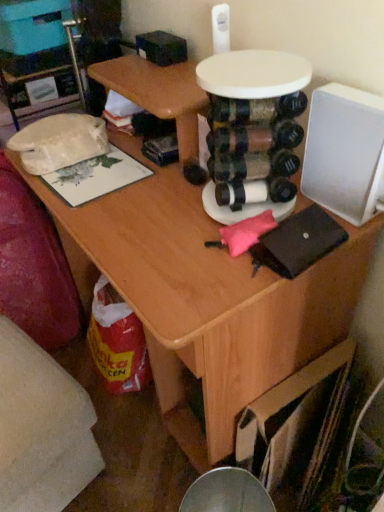
Question: From a real-world perspective, does white plastic round table at center sit lower than white fabric swivel chair at lower left?

Choices:
 (A) no
 (B) yes

Answer: (A)

Question: From a real-world perspective, is white plastic round table at center on white fabric swivel chair at lower left?

Choices:
 (A) yes
 (B) no

Answer: (A)

Question: Considering the relative sizes of white plastic round table at center and white fabric swivel chair at lower left in the image provided, is white plastic round table at center smaller than white fabric swivel chair at lower left?

Choices:
 (A) yes
 (B) no

Answer: (A)

Question: Does white plastic round table at center lie behind white fabric swivel chair at lower left?

Choices:
 (A) yes
 (B) no

Answer: (B)

Question: Is white plastic round table at center wider than white fabric swivel chair at lower left?

Choices:
 (A) yes
 (B) no

Answer: (B)

Question: Is white plastic round table at center positioned far away from white fabric swivel chair at lower left?

Choices:
 (A) yes
 (B) no

Answer: (B)

Question: Is white fabric swivel chair at lower left looking in the opposite direction of white plastic round table at center?

Choices:
 (A) no
 (B) yes

Answer: (A)

Question: From the image's perspective, does white fabric swivel chair at lower left appear higher than white plastic round table at center?

Choices:
 (A) no
 (B) yes

Answer: (A)

Question: Is the position of white fabric swivel chair at lower left more distant than that of white plastic round table at center?

Choices:
 (A) no
 (B) yes

Answer: (B)

Question: Considering the relative sizes of white fabric swivel chair at lower left and white plastic round table at center in the image provided, is white fabric swivel chair at lower left smaller than white plastic round table at center?

Choices:
 (A) yes
 (B) no

Answer: (B)

Question: Considering the relative sizes of white fabric swivel chair at lower left and white plastic round table at center in the image provided, is white fabric swivel chair at lower left shorter than white plastic round table at center?

Choices:
 (A) no
 (B) yes

Answer: (A)

Question: Does white fabric swivel chair at lower left have a lesser width compared to white plastic round table at center?

Choices:
 (A) yes
 (B) no

Answer: (B)

Question: Considering their positions, is white fabric swivel chair at lower left located in front of or behind white plastic round table at center?

Choices:
 (A) front
 (B) behind

Answer: (B)